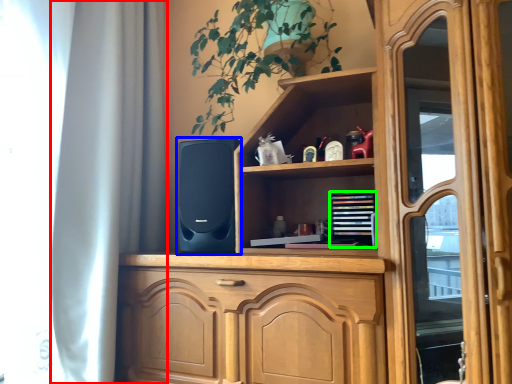
Question: Which object is the closest to the curtain (highlighted by a red box)? Choose among these: speaker (highlighted by a blue box) or book (highlighted by a green box).

Choices:
 (A) speaker
 (B) book

Answer: (A)